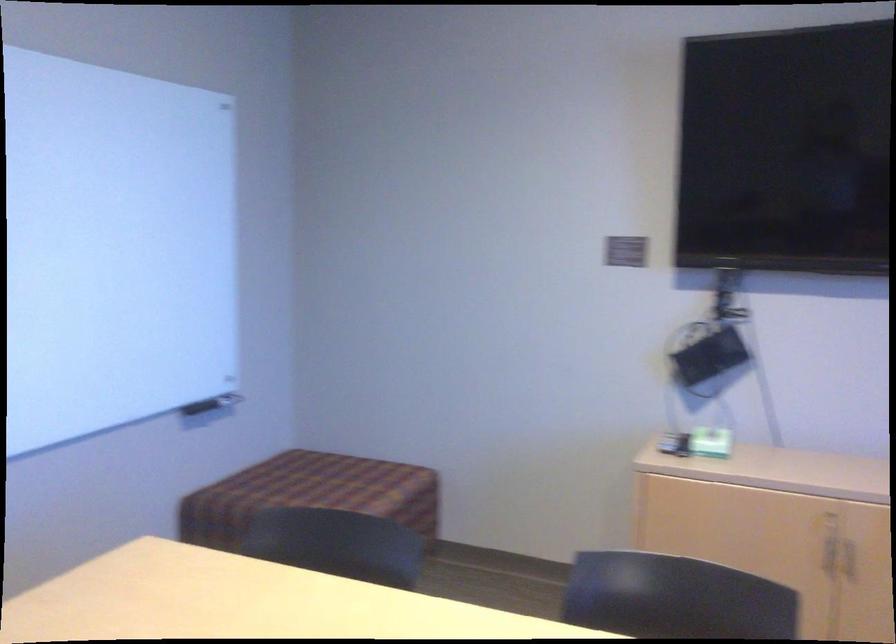
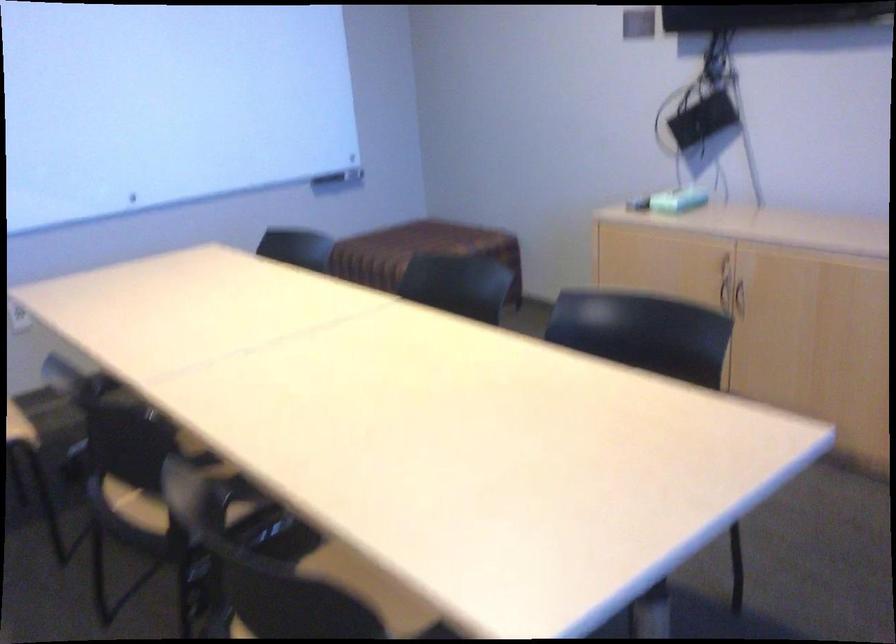
Locate, in the second image, the point that corresponds to point (707, 447) in the first image.

(677, 200)